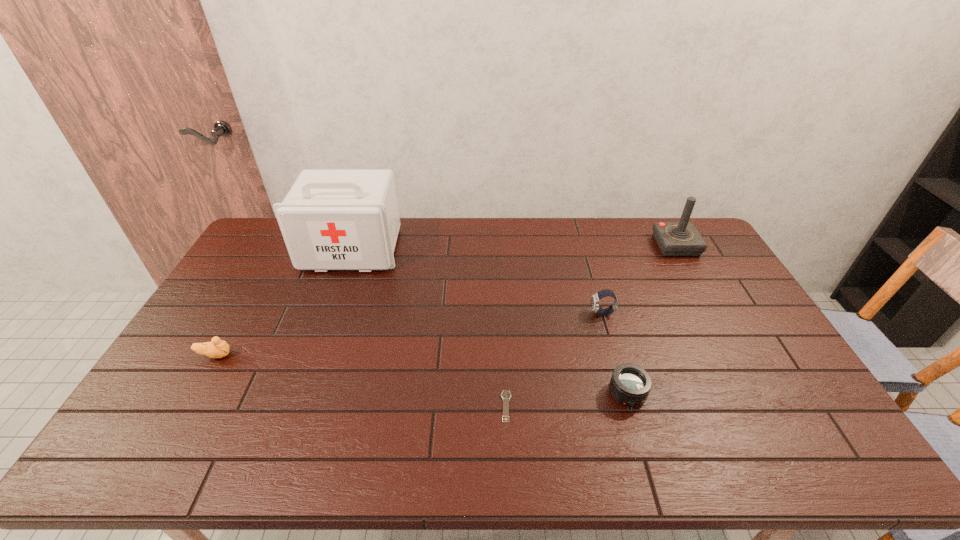
Image resolution: width=960 pixels, height=540 pixels. In order to click on the nearer watch in this screenshot , I will do `click(506, 395)`.

Where is `free region located 0.080m on the front-facing side of the first-aid kit`? free region located 0.080m on the front-facing side of the first-aid kit is located at coordinates (338, 289).

Find the location of a particular element. The image size is (960, 540). vacant area located 0.350m on the rectangular base of the joystick is located at coordinates (722, 329).

This screenshot has width=960, height=540. Find the location of `vacant area situated on the face of the taller watch`. vacant area situated on the face of the taller watch is located at coordinates (536, 314).

Locate an element on the screen. The height and width of the screenshot is (540, 960). free space located on the face of the taller watch is located at coordinates (540, 314).

Where is `free space located on the face of the taller watch`? free space located on the face of the taller watch is located at coordinates (504, 314).

The image size is (960, 540). I want to click on blank area located on the face of the leftmost object, so click(x=285, y=355).

Where is `blank space located 0.090m on the side of the telephoto lens with brand markings and control switches`? blank space located 0.090m on the side of the telephoto lens with brand markings and control switches is located at coordinates (642, 444).

Identify the location of vacant area located on the right of the left watch. (597, 406).

In order to click on the first-aid kit that is at the far edge in this screenshot , I will do `click(330, 219)`.